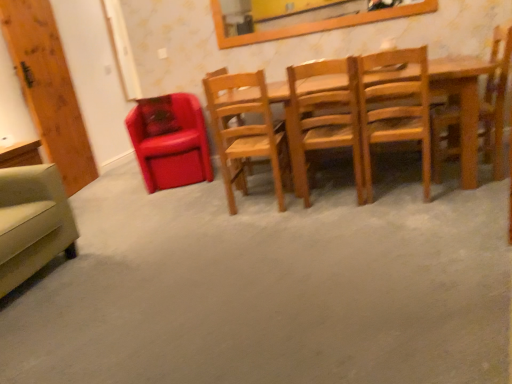
The height and width of the screenshot is (384, 512). I want to click on vacant area that lies to the right of beige fabric armchair at lower left, placed as the 6th chair when sorted from right to left, so click(117, 263).